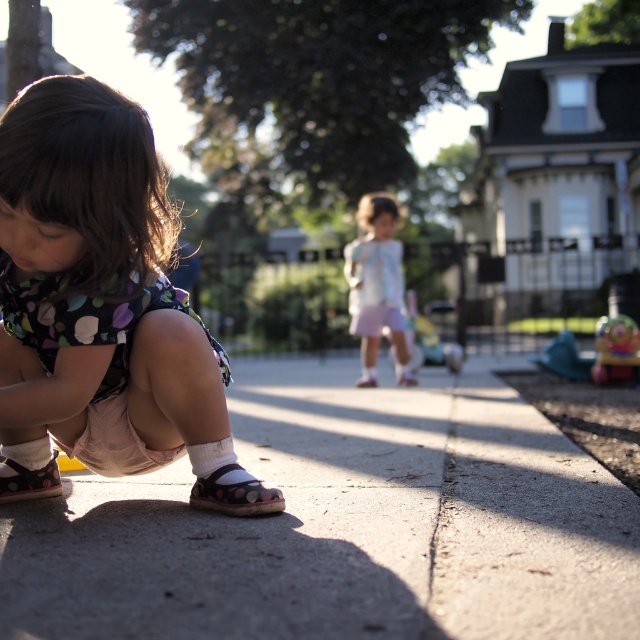
Does gray concrete pavement at lower center come in front of polka dot fabric dress at lower left?

Yes, it is.

Measure the distance between gray concrete pavement at lower center and camera.

The distance of gray concrete pavement at lower center from camera is 1.40 meters.

Is point (237, 522) positioned in front of point (109, 449)?

Yes, point (237, 522) is in front of point (109, 449).

Locate an element on the screen. The height and width of the screenshot is (640, 640). gray concrete pavement at lower center is located at coordinates (342, 524).

Which is below, polka dot fabric dress at lower left or matte plastic toy at lower right?

matte plastic toy at lower right

Where is `polka dot fabric dress at lower left`? This screenshot has height=640, width=640. polka dot fabric dress at lower left is located at coordinates (97, 292).

Looking at this image, can you confirm if light blue fabric dress at center is wider than brown fabric sandal at lower left?

Yes, light blue fabric dress at center is wider than brown fabric sandal at lower left.

Can you confirm if light blue fabric dress at center is smaller than brown fabric sandal at lower left?

No.

Between point (371, 300) and point (4, 460), which one is positioned in front?

Positioned in front is point (4, 460).

Identify the location of light blue fabric dress at center. (378, 285).